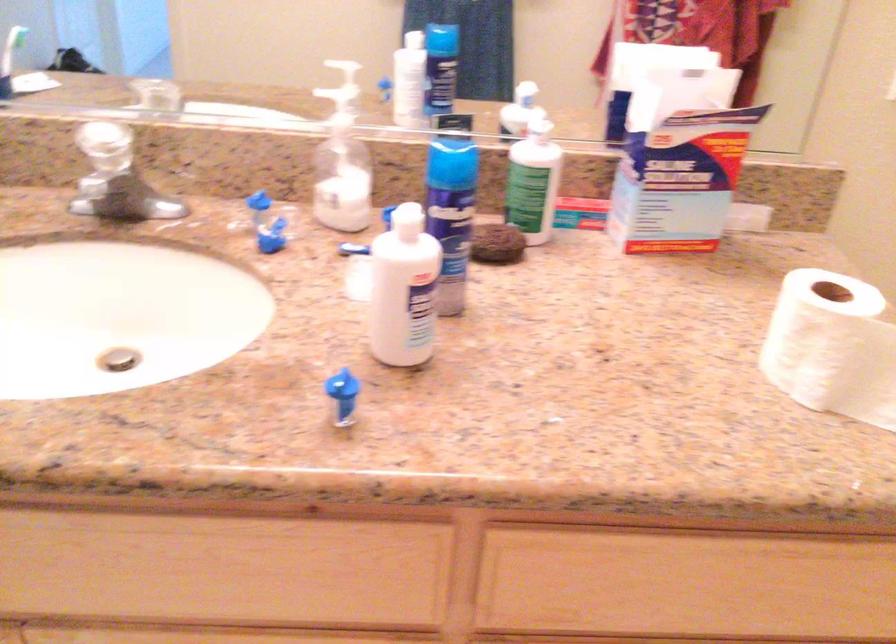
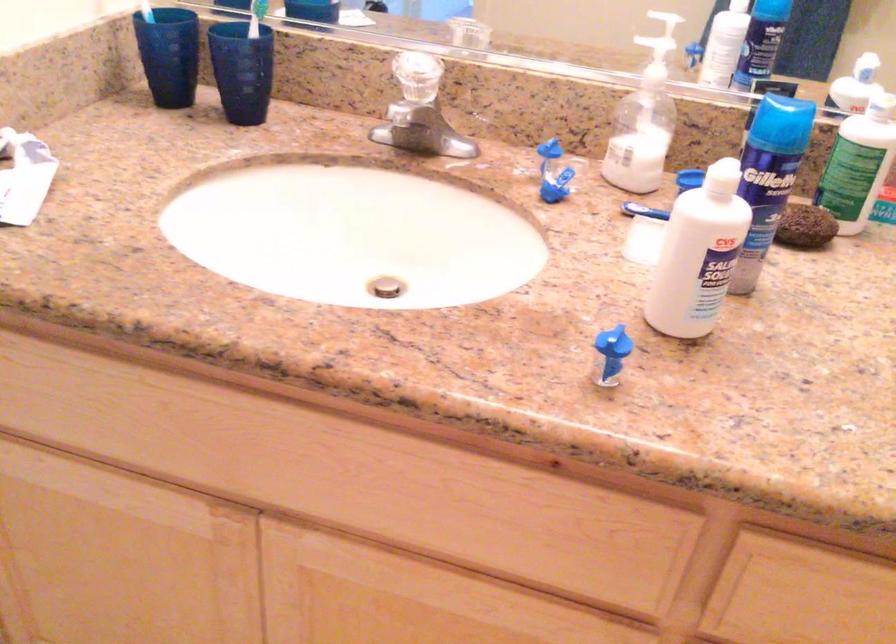
The point at (x=504, y=242) is marked in the first image. Where is the corresponding point in the second image?

(805, 227)